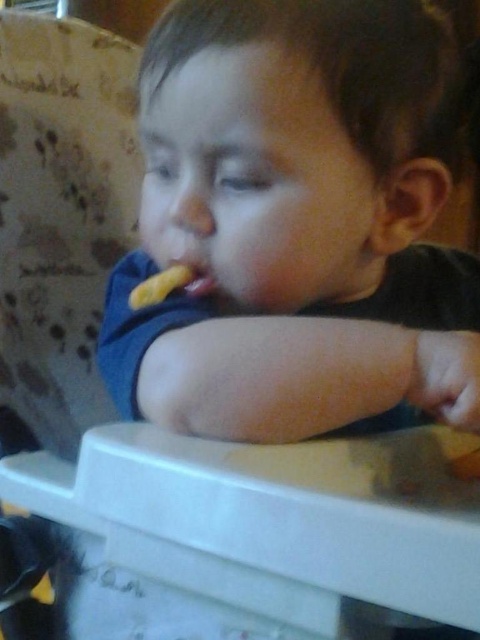
Question: Does yellow matte food at mouth have a smaller size compared to pink matte lips at center?

Choices:
 (A) no
 (B) yes

Answer: (A)

Question: Can you confirm if smooth blue shirt at center is positioned above pink matte lips at center?

Choices:
 (A) yes
 (B) no

Answer: (A)

Question: Estimate the real-world distances between objects in this image. Which object is closer to the yellow matte food at mouth?

Choices:
 (A) pink matte lips at center
 (B) smooth blue shirt at center

Answer: (A)

Question: Where is smooth blue shirt at center located in relation to yellow matte food at mouth in the image?

Choices:
 (A) below
 (B) above

Answer: (B)

Question: Which object appears closest to the camera in this image?

Choices:
 (A) yellow matte food at mouth
 (B) smooth blue shirt at center

Answer: (B)

Question: Which object is closer to the camera taking this photo?

Choices:
 (A) yellow matte food at mouth
 (B) smooth blue shirt at center
 (C) pink matte lips at center

Answer: (B)